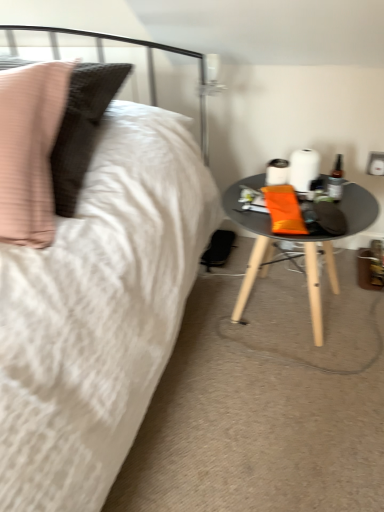
Question: Considering the positions of point (380, 174) and point (339, 172), is point (380, 174) closer or farther from the camera than point (339, 172)?

Choices:
 (A) farther
 (B) closer

Answer: (A)

Question: Is white glossy electric outlet at upper right situated inside translucent glass bottle at right or outside?

Choices:
 (A) outside
 (B) inside

Answer: (A)

Question: Considering the real-world distances, which object is closest to the matte black table at lower right?

Choices:
 (A) white glossy electric outlet at upper right
 (B) translucent glass bottle at right

Answer: (B)

Question: Which is farther from the white glossy electric outlet at upper right?

Choices:
 (A) matte black table at lower right
 (B) translucent glass bottle at right

Answer: (A)